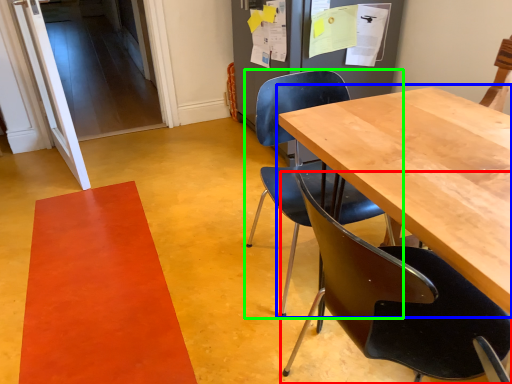
Question: Which object is positioned farthest from chair (highlighted by a red box)? Select from table (highlighted by a blue box) and chair (highlighted by a green box).

Choices:
 (A) table
 (B) chair

Answer: (B)